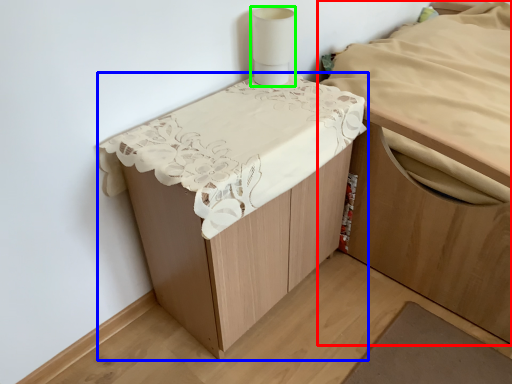
Question: Based on their relative distances, which object is nearer to furniture (highlighted by a red box)? Choose from furniture (highlighted by a blue box) and lamp (highlighted by a green box).

Choices:
 (A) furniture
 (B) lamp

Answer: (A)